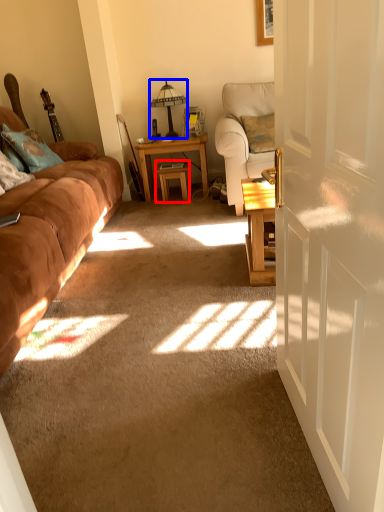
Question: Which object is closer to the camera taking this photo, table (highlighted by a red box) or table lamp (highlighted by a blue box)?

Choices:
 (A) table
 (B) table lamp

Answer: (B)